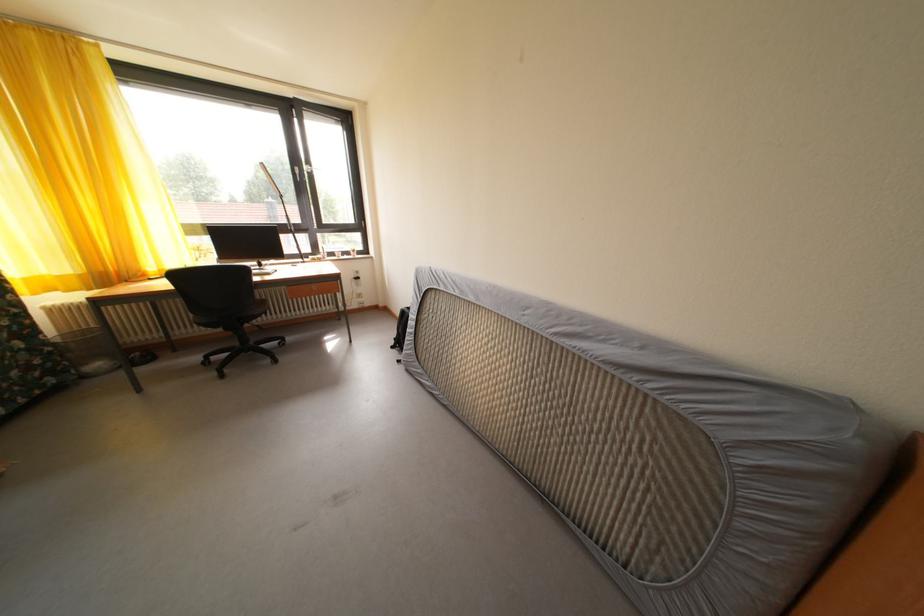
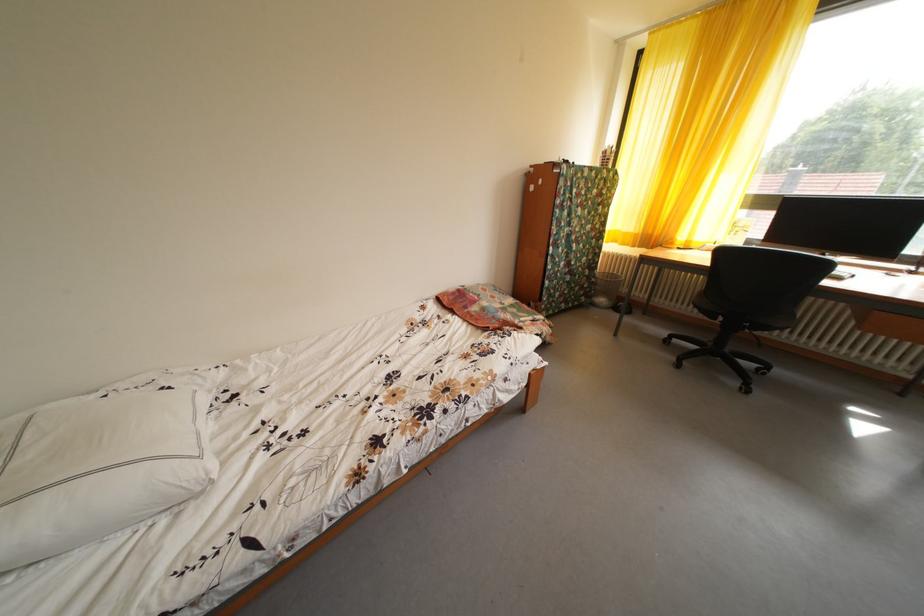
Based on the continuous images, in which direction is the camera rotating?

The rotation direction of the camera is left-down.